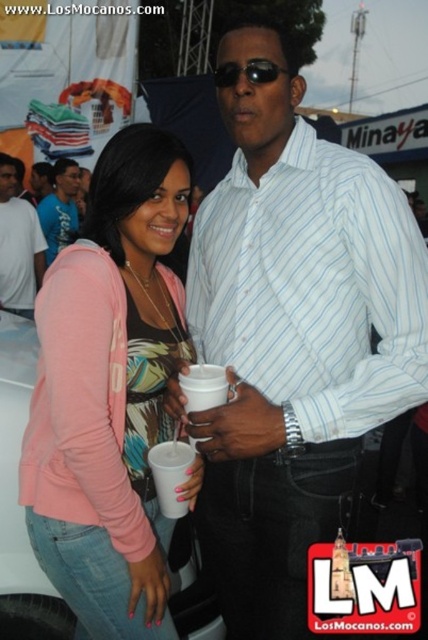
Does pink cotton shirt at left appear on the right side of sunglasses at center?

No, pink cotton shirt at left is not to the right of sunglasses at center.

Between pink cotton shirt at left and sunglasses at center, which one appears on the right side from the viewer's perspective?

sunglasses at center

The width and height of the screenshot is (428, 640). In order to click on pink cotton shirt at left in this screenshot , I will do `click(82, 403)`.

Identify the location of pink cotton shirt at left. (82, 403).

Is matte white t-shirt at center positioned at the back of white plastic cup at center?

Yes.

Who is more forward, (2, 221) or (157, 484)?

Point (157, 484) is in front.

Find the location of `matte white t-shirt at center`. matte white t-shirt at center is located at coordinates (17, 244).

Can you confirm if pink cotton shirt at left is positioned to the right of white plastic cup at center?

Incorrect, pink cotton shirt at left is not on the right side of white plastic cup at center.

In the scene shown: Which is more to the right, pink cotton shirt at left or white plastic cup at center?

Positioned to the right is white plastic cup at center.

Is point (59, 266) positioned before point (152, 449)?

Yes, point (59, 266) is in front of point (152, 449).

This screenshot has height=640, width=428. I want to click on pink cotton shirt at left, so click(x=82, y=403).